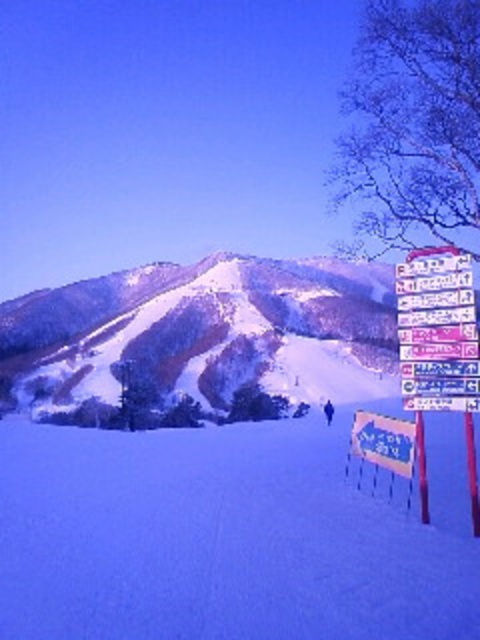
You are a skier planning to descend the white snow ski slope at lower left. There is a white plastic sign at right nearby. Can you estimate which one occupies more space in the image?

The white snow ski slope at lower left has a larger size compared to the white plastic sign at right, so the white snow ski slope at lower left occupies more space in the image.

You are standing at the point marked by the signpost on the right side of the ski resort scene. You want to walk to the point labeled as point 1 at coordinate (288, 592) and then to point 2 at coordinate (405, 394). Which point should you reach first?

You should reach point 1 at coordinate (288, 592) first because it is closer to the viewer than point 2 at coordinate (405, 394).

You are a skier planning to descend the slope. From your current position, which object would you see first as you look down the slope? The white snow ski slope at lower left or the blue plastic sign at lower right?

The white snow ski slope at lower left is larger in size than the blue plastic sign at lower right, so you would see the white snow ski slope at lower left first because it occupies a bigger area in your view.